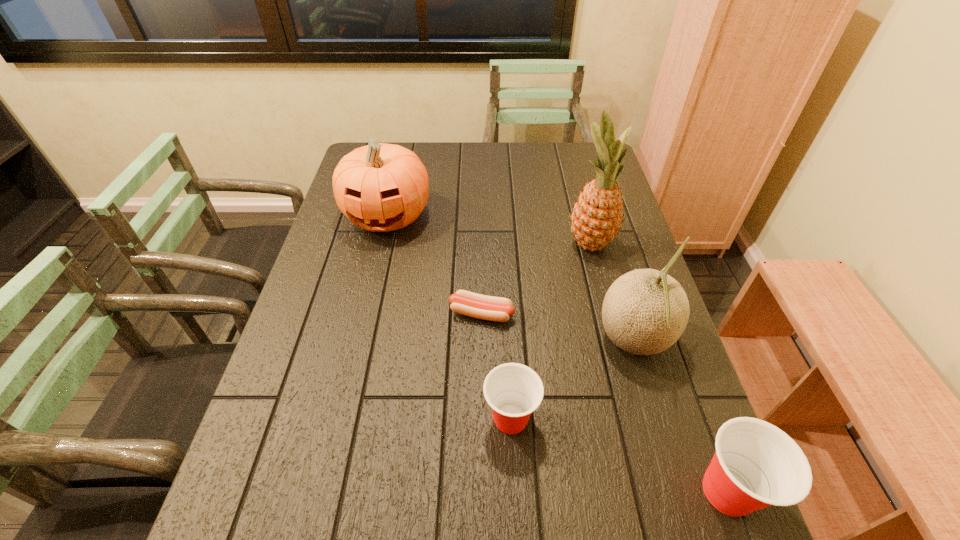
In order to click on vacant position in the image that satisfies the following two spatial constraints: 1. on the front-facing side of the pumpkin; 2. on the left side of the left cup in this screenshot , I will do `click(340, 418)`.

Image resolution: width=960 pixels, height=540 pixels. I want to click on vacant space that satisfies the following two spatial constraints: 1. on the front-facing side of the pumpkin; 2. on the right side of the shortest object, so click(x=365, y=313).